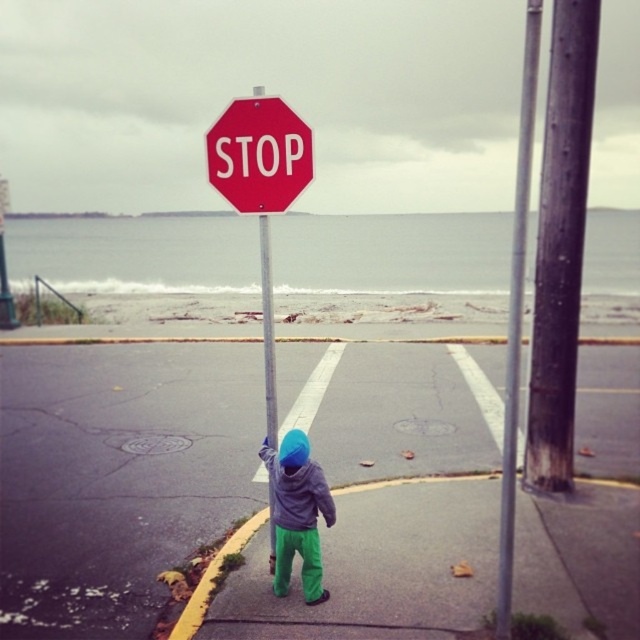
From the picture: Who is higher up, red matte stop sign at center or metallic pole at right?

Positioned higher is metallic pole at right.

What do you see at coordinates (260, 188) in the screenshot? The height and width of the screenshot is (640, 640). I see `red matte stop sign at center` at bounding box center [260, 188].

What do you see at coordinates (260, 188) in the screenshot? I see `red matte stop sign at center` at bounding box center [260, 188].

Where is `red matte stop sign at center`? The image size is (640, 640). red matte stop sign at center is located at coordinates (260, 188).

Consider the image. Which is below, smooth asphalt road at center or gray fleece hoodie at center?

gray fleece hoodie at center is lower down.

Is smooth asphalt road at center below gray fleece hoodie at center?

No, smooth asphalt road at center is not below gray fleece hoodie at center.

Which is behind, point (195, 454) or point (288, 550)?

The point (195, 454) is behind.

The height and width of the screenshot is (640, 640). Identify the location of smooth asphalt road at center. (120, 470).

Is red matte stop sign at upper center positioned behind gray fleece hoodie at center?

Yes, red matte stop sign at upper center is further from the viewer.

Which is in front, point (296, 150) or point (296, 493)?

Point (296, 493)

Where is `red matte stop sign at upper center`? red matte stop sign at upper center is located at coordinates (259, 154).

Where is `red matte stop sign at upper center`? This screenshot has width=640, height=640. red matte stop sign at upper center is located at coordinates (259, 154).